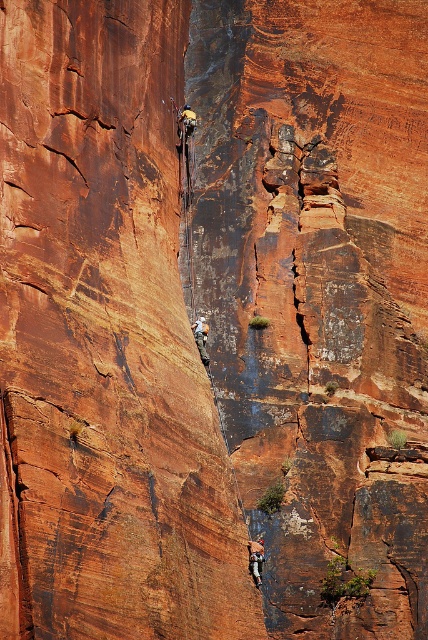
Question: Can you confirm if matte climbing harness at center is wider than matte gray rock climber at center?

Choices:
 (A) no
 (B) yes

Answer: (A)

Question: Is matte climbing harness at center to the right of matte gray rock climber at center from the viewer's perspective?

Choices:
 (A) yes
 (B) no

Answer: (A)

Question: Among these objects, which one is farthest from the camera?

Choices:
 (A) matte climbing harness at center
 (B) matte gray rock climber at center

Answer: (B)

Question: Which point is farther to the camera?

Choices:
 (A) matte climbing harness at center
 (B) matte gray rock climber at center

Answer: (B)

Question: Observing the image, what is the correct spatial positioning of matte climbing harness at center in reference to matte gray rock climber at center?

Choices:
 (A) left
 (B) right

Answer: (B)